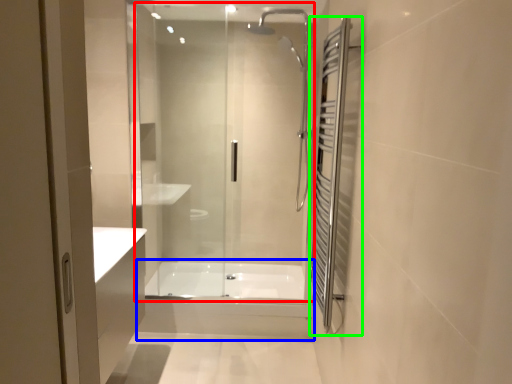
Question: Which object is the farthest from shower door (highlighted by a red box)? Choose among these: bath (highlighted by a blue box) or screen door (highlighted by a green box).

Choices:
 (A) bath
 (B) screen door

Answer: (A)